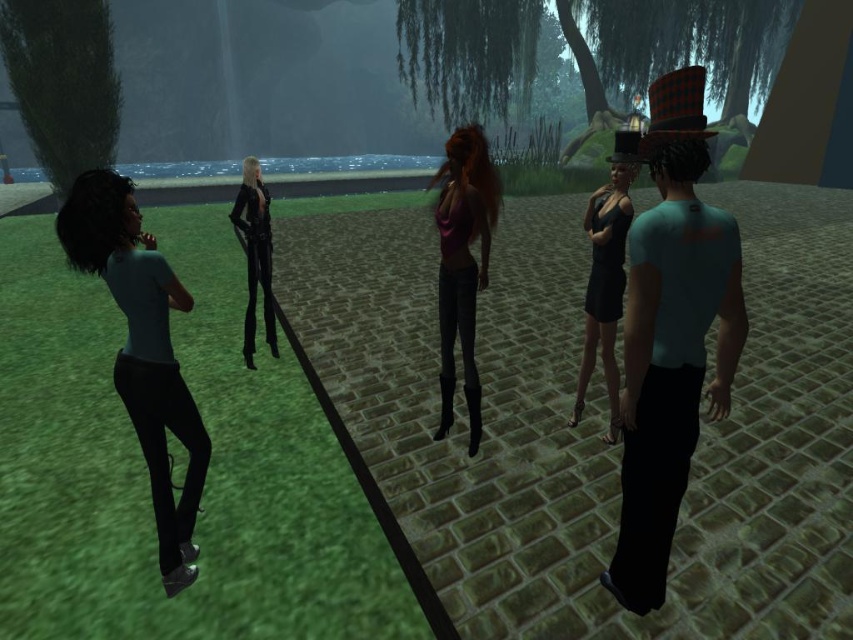
You are a fashion designer analyzing the avatars in the scene. The avatars are wearing a shiny black dress at center and shiny black leather pants at center. Which of these two items has a greater width?

The shiny black dress at center has a greater width than the shiny black leather pants at center according to the description.

You are an avatar in this virtual environment and want to interact with the shiny purple top at center and the shiny black leather pants at center. Which one would you need to walk forward to reach first?

You would need to walk forward to reach the shiny black leather pants at center first because the shiny purple top at center is closer to the viewer than the shiny black leather pants at center, meaning the pants are further away and require moving forward more.

You are an avatar in the virtual environment. You see the matte blue shirt at left and the shiny black dress at center. Which avatar is positioned lower on the screen?

The matte blue shirt at left is located below the shiny black dress at center, so it is positioned lower on the screen.